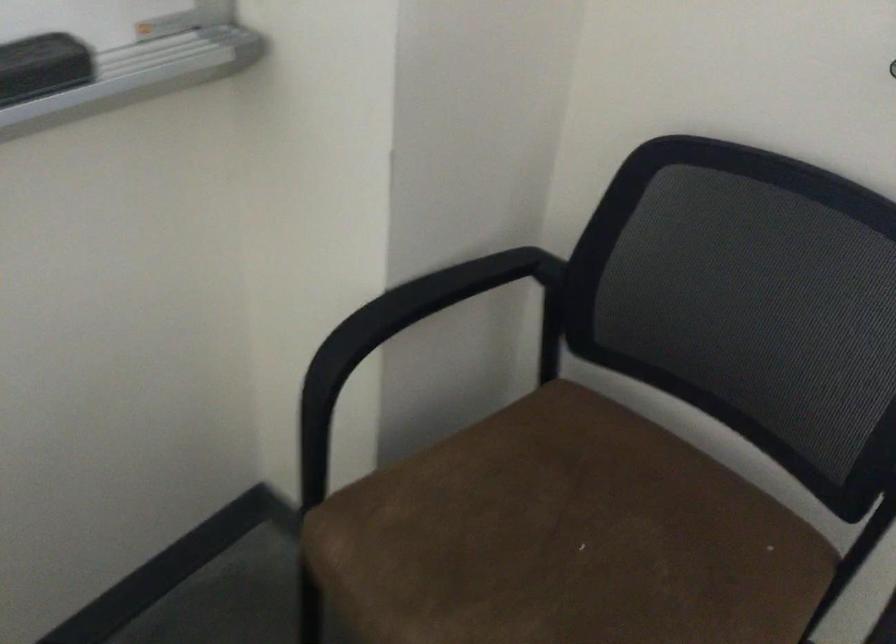
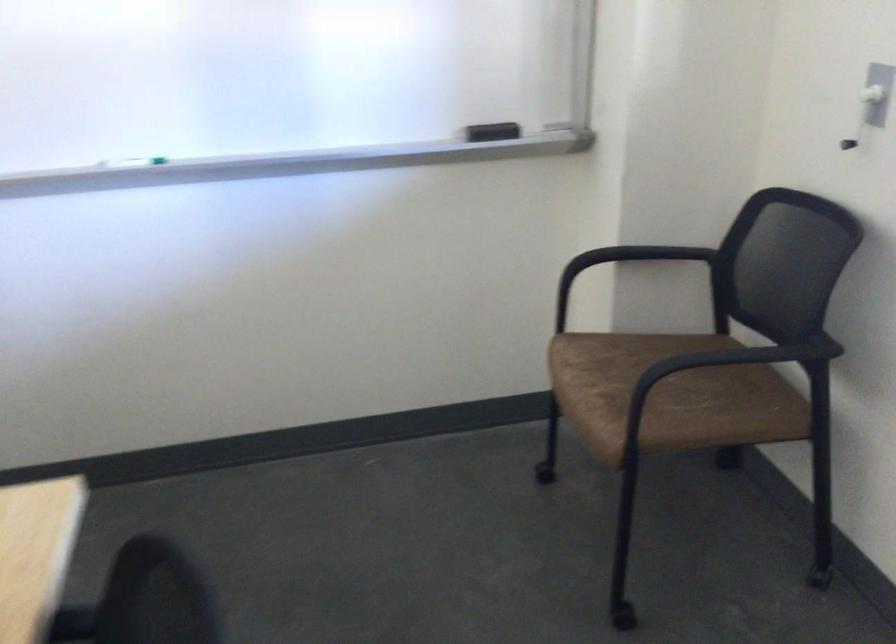
The point at (676, 489) is marked in the first image. Where is the corresponding point in the second image?

(745, 381)